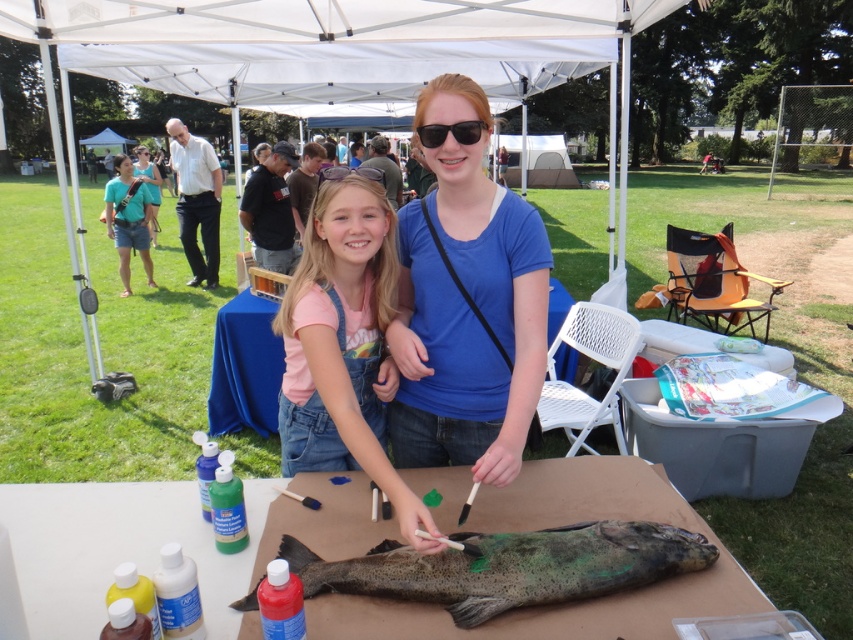
Question: Which of the following is the farthest from the observer?

Choices:
 (A) white fabric canopy at upper center
 (B) pink denim overalls at center

Answer: (A)

Question: Can you confirm if matte cardboard table at center is positioned below black plastic goggles at center?

Choices:
 (A) yes
 (B) no

Answer: (A)

Question: Which object appears closest to the camera in this image?

Choices:
 (A) white fabric canopy at upper center
 (B) matte teal shirt at upper left
 (C) speckled dark fish at center
 (D) matte cardboard table at center

Answer: (C)

Question: Does speckled dark fish at center appear on the left side of matte teal shirt at upper left?

Choices:
 (A) yes
 (B) no

Answer: (B)

Question: Does blue cotton shirt at center have a smaller size compared to white fabric canopy at upper center?

Choices:
 (A) no
 (B) yes

Answer: (A)

Question: Estimate the real-world distances between objects in this image. Which object is closer to the pink denim overalls at center?

Choices:
 (A) speckled dark fish at center
 (B) matte cardboard table at center
 (C) matte teal shirt at upper left

Answer: (A)